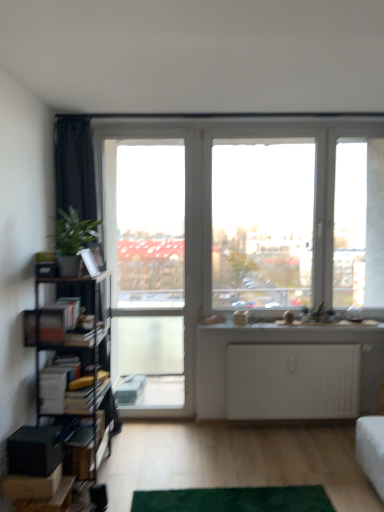
This screenshot has height=512, width=384. Find the location of `free space to the back side of green carpet at lower center`. free space to the back side of green carpet at lower center is located at coordinates (226, 449).